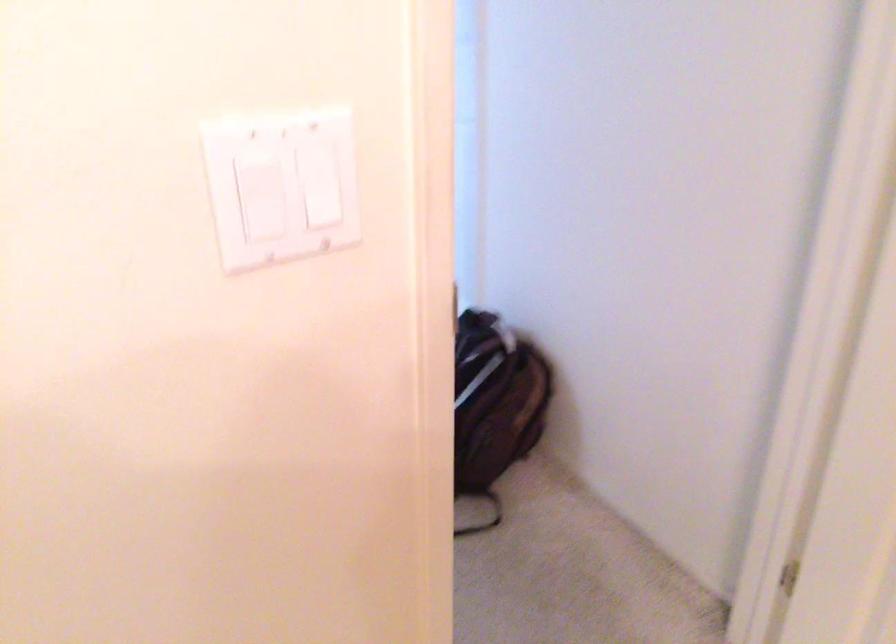
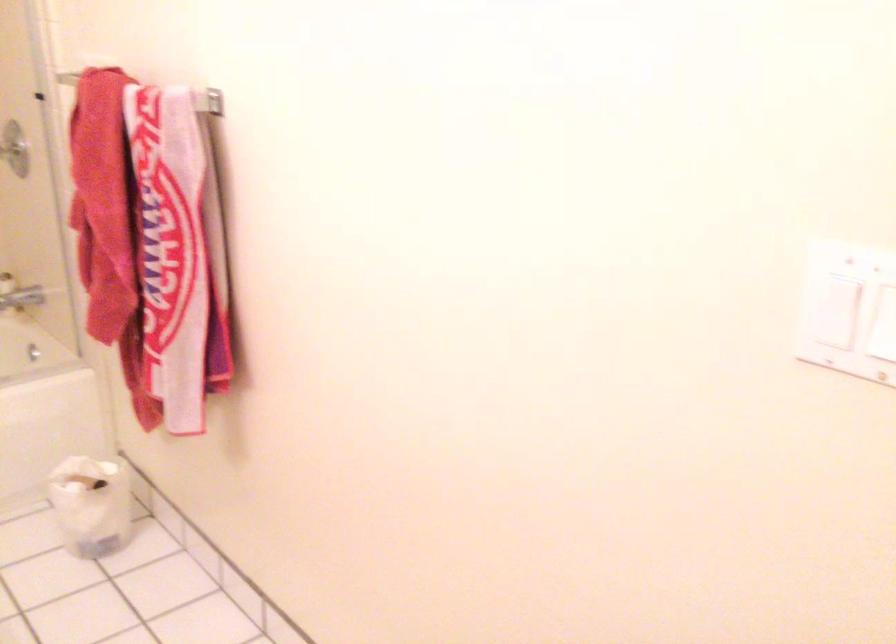
In the second image, find the point that corresponds to (264,214) in the first image.

(831, 295)